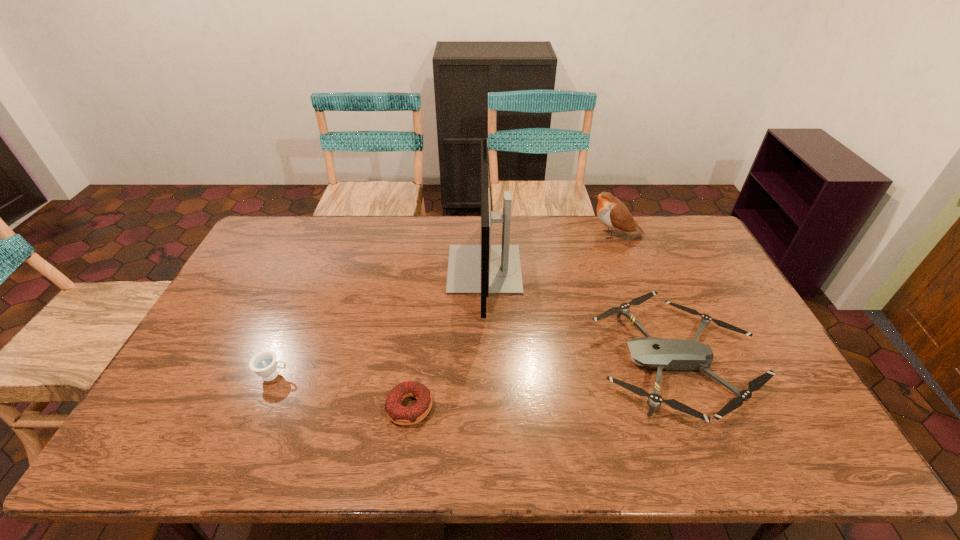
This screenshot has width=960, height=540. I want to click on free space that is in between the doughnut and the bird, so click(x=513, y=321).

The image size is (960, 540). Identify the location of vacant area that lies between the computer monitor and the second tallest object. (549, 252).

At what (x,y) coordinates should I click in order to perform the action: click on vacant region between the drone and the leftmost object. Please return your answer as a coordinate pair (x, y). The image size is (960, 540). Looking at the image, I should click on (475, 369).

Locate an element on the screen. Image resolution: width=960 pixels, height=540 pixels. free space between the teacup and the computer monitor is located at coordinates (379, 322).

Where is `empty space between the bird and the teacup`? This screenshot has height=540, width=960. empty space between the bird and the teacup is located at coordinates (444, 305).

I want to click on free space between the doughnut and the tallest object, so click(447, 338).

The width and height of the screenshot is (960, 540). I want to click on the second closest object relative to the second tallest object, so (x=670, y=354).

Where is `object that ranks as the fourth closest to the leftmost object`? Image resolution: width=960 pixels, height=540 pixels. object that ranks as the fourth closest to the leftmost object is located at coordinates (614, 214).

This screenshot has width=960, height=540. Identify the location of vacant area in the image that satisfies the following two spatial constraints: 1. with a camera mounted on the front of the drone; 2. on the front side of the shortest object. (694, 407).

This screenshot has width=960, height=540. I want to click on free location that satisfies the following two spatial constraints: 1. on the side of the leftmost object with the handle; 2. on the left side of the doughnut, so click(260, 407).